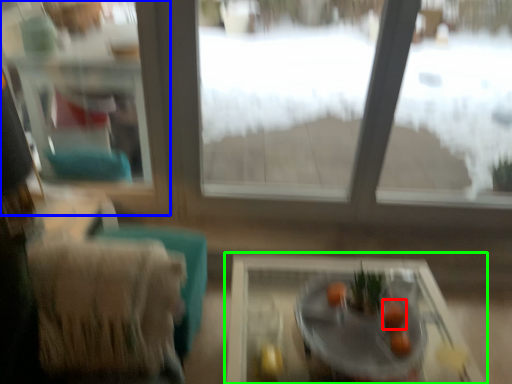
Question: Estimate the real-world distances between objects in this image. Which object is farther from fruit (highlighted by a red box), window frame (highlighted by a blue box) or table (highlighted by a green box)?

Choices:
 (A) window frame
 (B) table

Answer: (A)